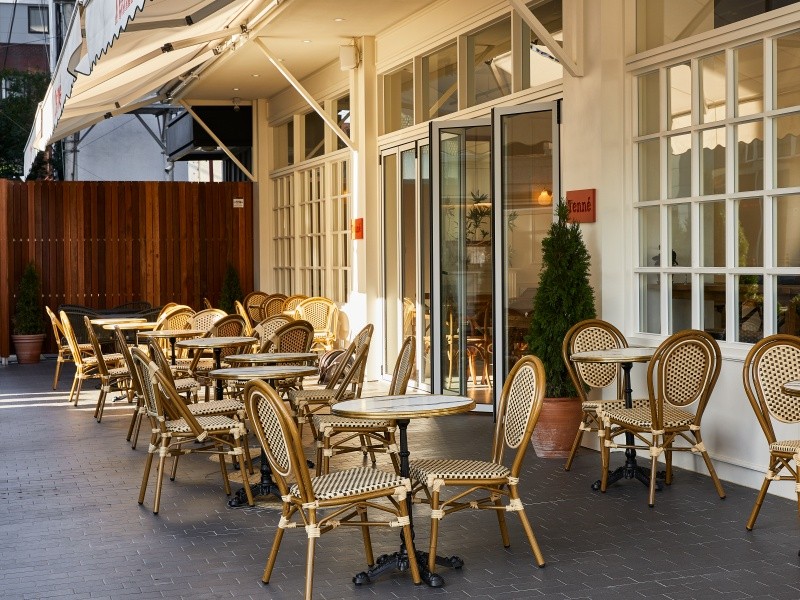
Locate an element on the screen. Image resolution: width=800 pixels, height=600 pixels. tables is located at coordinates (406, 407), (630, 350), (792, 384), (277, 371), (281, 354), (225, 335), (182, 329), (138, 324), (118, 322).